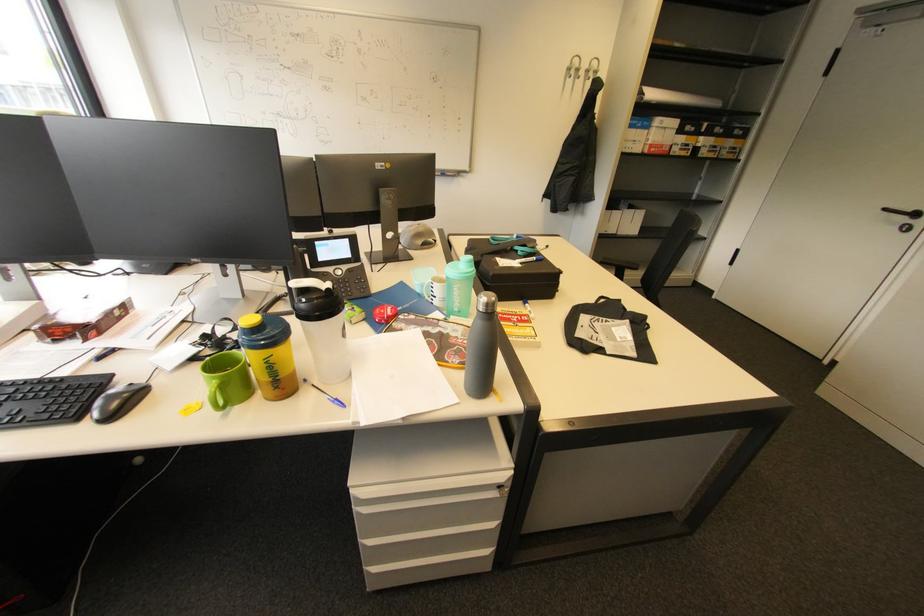
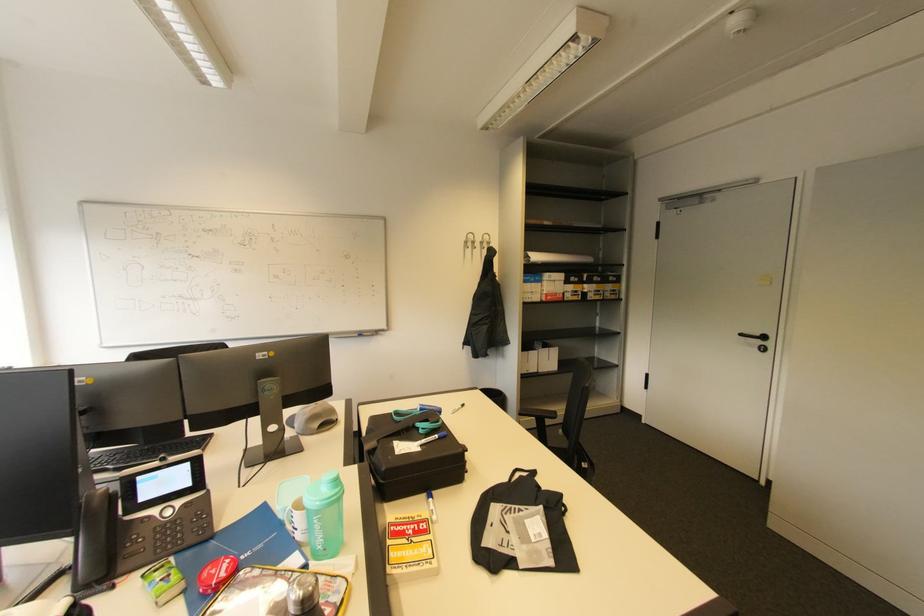
Locate, in the second image, the point that corresponds to the point at 627,203 in the first image.

(541, 342)